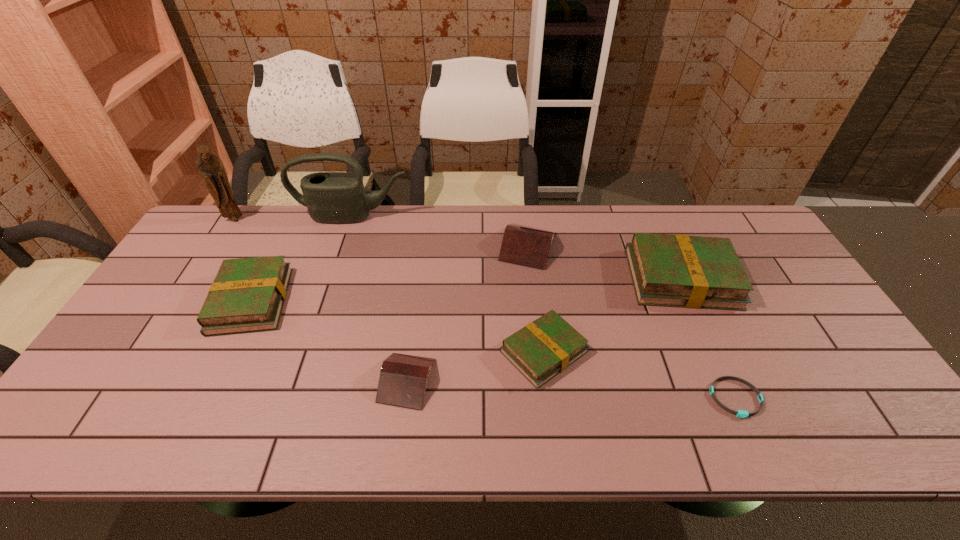
Where is `vacant space at the left edge of the desktop`? vacant space at the left edge of the desktop is located at coordinates (210, 266).

I want to click on vacant space at the right edge of the desktop, so click(x=759, y=278).

Where is `blank region between the farther brown book and the smaller brown book`? The image size is (960, 540). blank region between the farther brown book and the smaller brown book is located at coordinates (468, 314).

Where is `free spot between the smallest yellow book and the rightmost book`? Image resolution: width=960 pixels, height=540 pixels. free spot between the smallest yellow book and the rightmost book is located at coordinates (612, 315).

You are a GUI agent. You are given a task and a screenshot of the screen. Output one action in this format:
    pyautogui.click(x=<x>, y=<y>)
    Task: Click on the empty location between the second yellow book from left to right and the left brown book
    The image size is (960, 540).
    Given the screenshot: What is the action you would take?
    pyautogui.click(x=475, y=366)

You are a GUI agent. You are given a task and a screenshot of the screen. Output one action in this format:
    pyautogui.click(x=<x>, y=<y>)
    Task: Click on the free spot between the left brown book and the wristband
    This screenshot has height=540, width=960.
    Given the screenshot: What is the action you would take?
    pyautogui.click(x=571, y=389)

The image size is (960, 540). Identify the location of unoccupied area between the tallest object and the gray wristband. (486, 309).

Where is `free area in between the biggest yellow book and the wristband`? The image size is (960, 540). free area in between the biggest yellow book and the wristband is located at coordinates (708, 339).

Locate an element on the screen. empty space between the leftmost object and the nearer brown book is located at coordinates (321, 300).

Where is `vacant space that's between the gray wristband and the nearer brown book`? The image size is (960, 540). vacant space that's between the gray wristband and the nearer brown book is located at coordinates (571, 389).